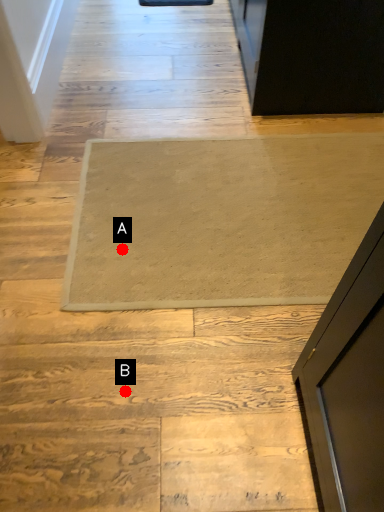
Question: Two points are circled on the image, labeled by A and B beside each circle. Among these points, which one is nearest to the camera?

Choices:
 (A) A is closer
 (B) B is closer

Answer: (B)